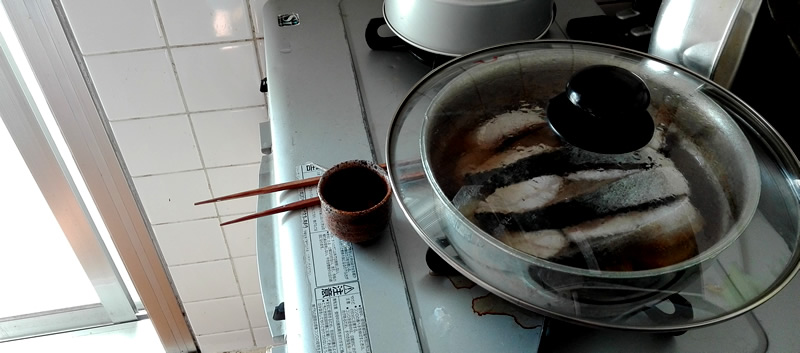
The image size is (800, 353). Identify the location of window. (42, 261).